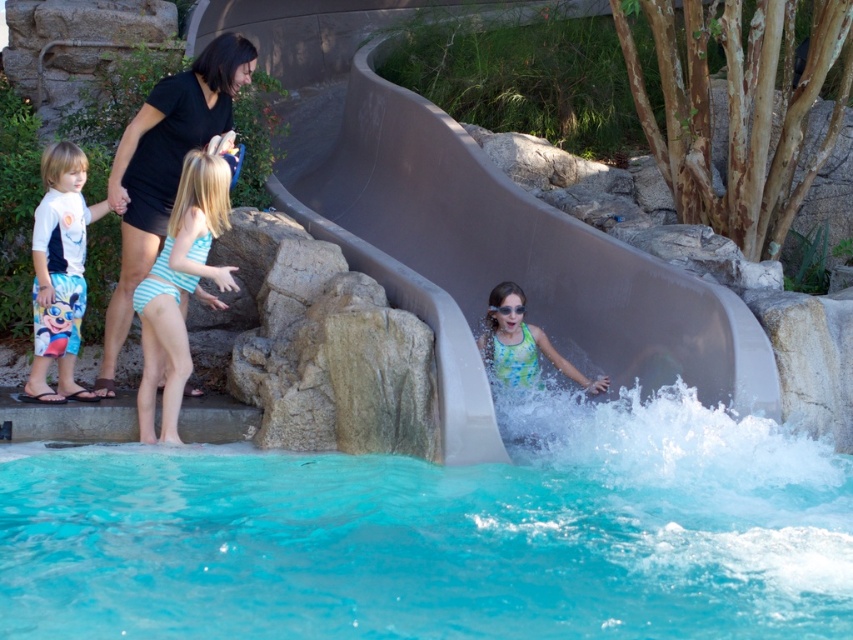
Can you confirm if smooth gray slide at center is taller than transparent plastic goggles at center?

Yes.

Is smooth gray slide at center further to the viewer compared to transparent plastic goggles at center?

That is False.

At what (x,y) coordinates should I click in order to perform the action: click on smooth gray slide at center. Please return your answer as a coordinate pair (x, y). Image resolution: width=853 pixels, height=640 pixels. Looking at the image, I should click on (479, 234).

Who is positioned more to the left, clear blue water at lower center or blue striped swimsuit at left?

blue striped swimsuit at left is more to the left.

Between clear blue water at lower center and blue striped swimsuit at left, which one is positioned higher?

blue striped swimsuit at left is higher up.

Describe the element at coordinates (440, 536) in the screenshot. I see `clear blue water at lower center` at that location.

At what (x,y) coordinates should I click in order to perform the action: click on clear blue water at lower center. Please return your answer as a coordinate pair (x, y). The height and width of the screenshot is (640, 853). Looking at the image, I should click on coord(440,536).

Which is more to the left, smooth gray slide at center or black matte dress at upper left?

Positioned to the left is black matte dress at upper left.

Is point (421, 106) farther from camera compared to point (114, 342)?

That is True.

Identify the location of smooth gray slide at center. The width and height of the screenshot is (853, 640). (479, 234).